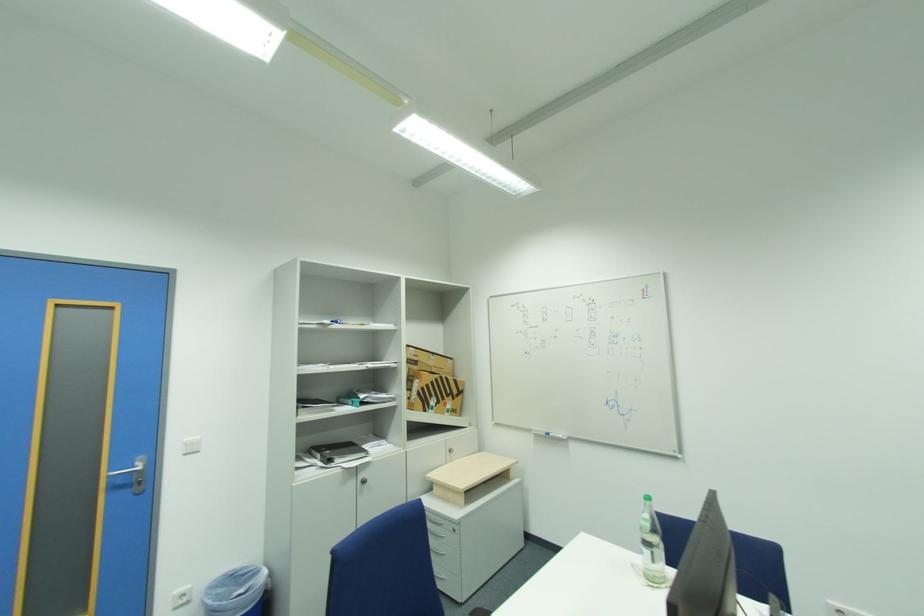
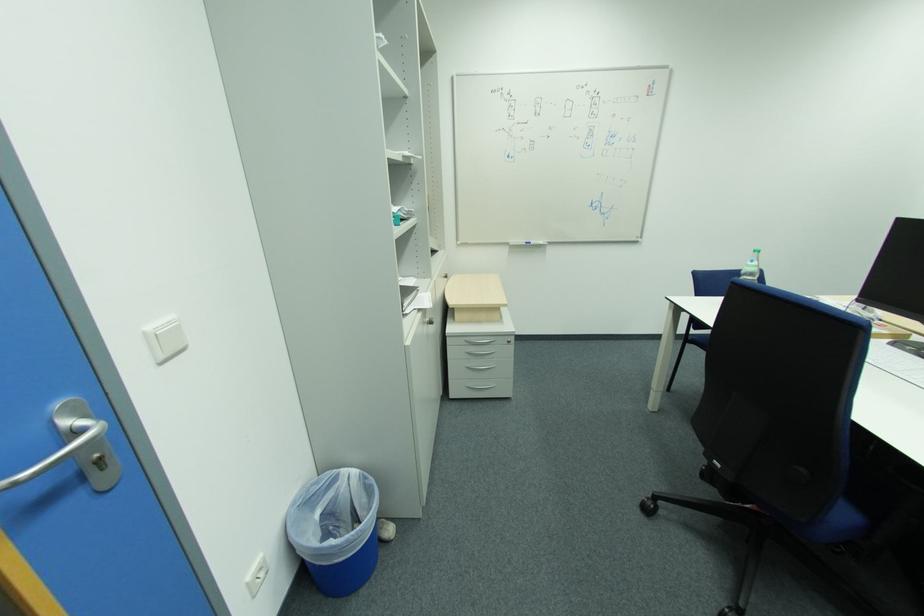
The point at (650, 520) is marked in the first image. Where is the corresponding point in the second image?

(758, 267)